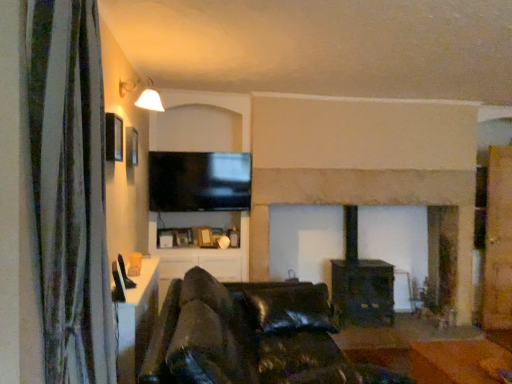
Question: Does black glossy tv at upper center have a lesser height compared to orange leather couch at lower center?

Choices:
 (A) no
 (B) yes

Answer: (A)

Question: Can you confirm if black glossy tv at upper center is positioned to the right of orange leather couch at lower center?

Choices:
 (A) no
 (B) yes

Answer: (A)

Question: Is black glossy tv at upper center far away from orange leather couch at lower center?

Choices:
 (A) yes
 (B) no

Answer: (A)

Question: From a real-world perspective, is black glossy tv at upper center under orange leather couch at lower center?

Choices:
 (A) yes
 (B) no

Answer: (B)

Question: From the image's perspective, is black glossy tv at upper center beneath orange leather couch at lower center?

Choices:
 (A) no
 (B) yes

Answer: (A)

Question: Is black glossy tv at upper center oriented towards orange leather couch at lower center?

Choices:
 (A) no
 (B) yes

Answer: (A)

Question: From a real-world perspective, does black leather couch at center sit lower than black glossy tv at upper center?

Choices:
 (A) yes
 (B) no

Answer: (A)

Question: Is black glossy tv at upper center completely or partially inside black leather couch at center?

Choices:
 (A) no
 (B) yes

Answer: (A)

Question: From a real-world perspective, is black leather couch at center positioned over black glossy tv at upper center based on gravity?

Choices:
 (A) no
 (B) yes

Answer: (A)

Question: From the image's perspective, is black leather couch at center located beneath black glossy tv at upper center?

Choices:
 (A) yes
 (B) no

Answer: (A)

Question: Does black leather couch at center have a greater width compared to black glossy tv at upper center?

Choices:
 (A) no
 (B) yes

Answer: (B)

Question: From the image's perspective, is black leather couch at center on top of black glossy tv at upper center?

Choices:
 (A) yes
 (B) no

Answer: (B)

Question: Is black leather couch at center facing towards green fabric curtain at left?

Choices:
 (A) yes
 (B) no

Answer: (B)